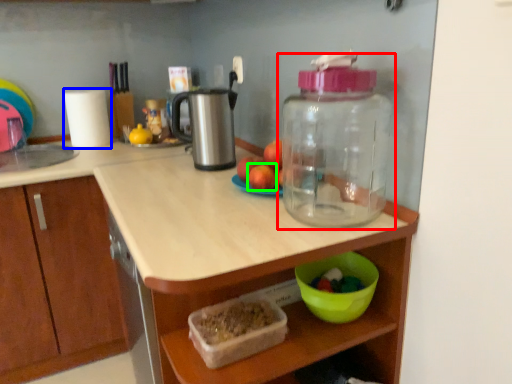
Question: Which is nearer to the bottle (highlighted by a red box)? paper towel (highlighted by a blue box) or apple (highlighted by a green box).

Choices:
 (A) paper towel
 (B) apple

Answer: (B)